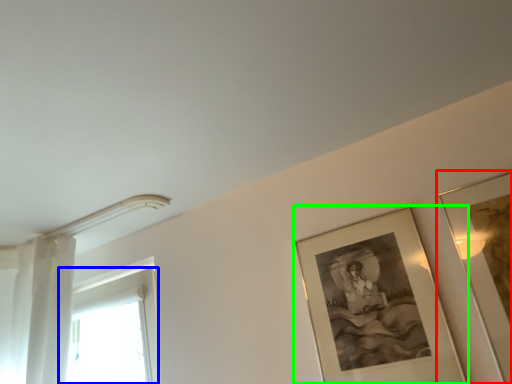
Question: Based on their relative distances, which object is farther from picture frame (highlighted by a red box)? Choose from window (highlighted by a blue box) and picture frame (highlighted by a green box).

Choices:
 (A) window
 (B) picture frame

Answer: (A)